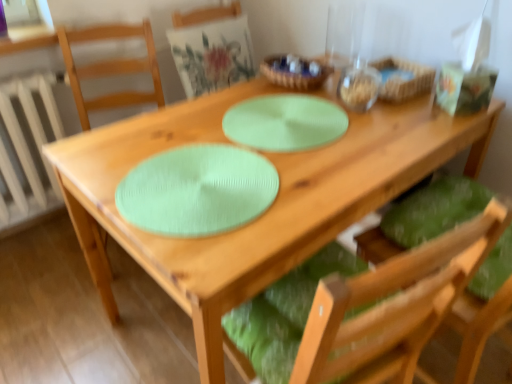
This screenshot has width=512, height=384. I want to click on free space to the left of green textured placemat at center, so click(179, 137).